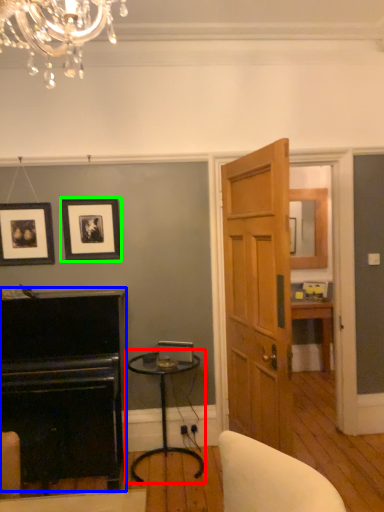
Question: Estimate the real-world distances between objects in this image. Which object is farther from table (highlighted by a red box), fireplace (highlighted by a blue box) or picture frame (highlighted by a green box)?

Choices:
 (A) fireplace
 (B) picture frame

Answer: (B)